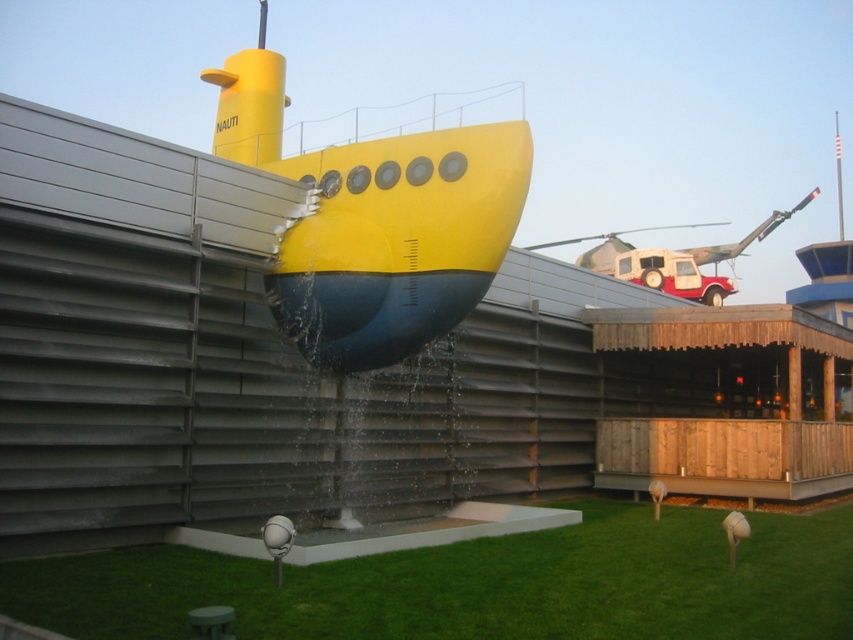
Is green artificial turf at lower center wider than yellow matte submarine at center?

In fact, green artificial turf at lower center might be narrower than yellow matte submarine at center.

Between point (22, 593) and point (346, 317), which one is positioned in front?

Point (22, 593) is in front.

Does point (518, 554) come farther from viewer compared to point (341, 148)?

No, (518, 554) is in front of (341, 148).

Locate an element on the screen. green artificial turf at lower center is located at coordinates (477, 584).